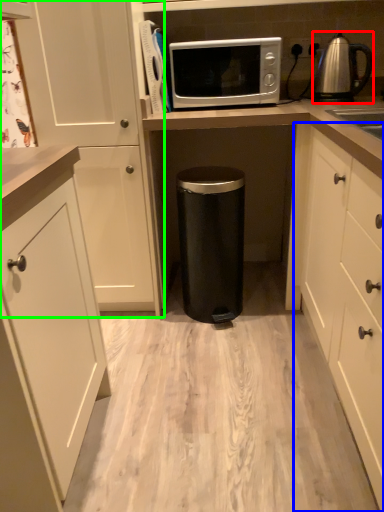
Question: Considering the real-world distances, which object is farthest from kettle (highlighted by a red box)? cabinetry (highlighted by a blue box) or cabinetry (highlighted by a green box)?

Choices:
 (A) cabinetry
 (B) cabinetry

Answer: (B)